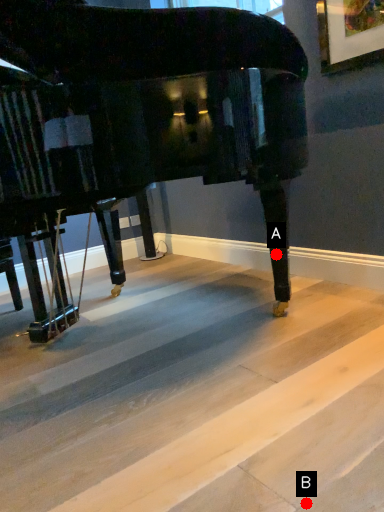
Question: Two points are circled on the image, labeled by A and B beside each circle. Which of the following is the farthest from the observer?

Choices:
 (A) A is further
 (B) B is further

Answer: (A)